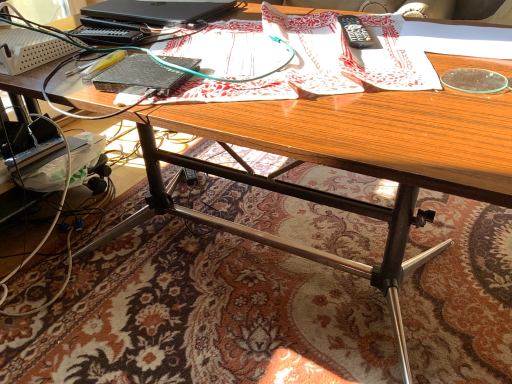
Question: Is the depth of patterned paper at center less than that of black plastic remote control at upper right?

Choices:
 (A) yes
 (B) no

Answer: (A)

Question: Is patterned paper at center touching black plastic remote control at upper right?

Choices:
 (A) yes
 (B) no

Answer: (B)

Question: From the image's perspective, is patterned paper at center on black plastic remote control at upper right?

Choices:
 (A) no
 (B) yes

Answer: (A)

Question: Is patterned paper at center positioned with its back to black plastic remote control at upper right?

Choices:
 (A) yes
 (B) no

Answer: (B)

Question: Considering the relative sizes of patterned paper at center and black plastic remote control at upper right in the image provided, is patterned paper at center shorter than black plastic remote control at upper right?

Choices:
 (A) no
 (B) yes

Answer: (A)

Question: Is patterned paper at center at the right side of black plastic remote control at upper right?

Choices:
 (A) no
 (B) yes

Answer: (A)

Question: Is the position of black matte laptop at upper left less distant than that of black plastic remote control at upper right?

Choices:
 (A) no
 (B) yes

Answer: (A)

Question: Does black matte laptop at upper left contain black plastic remote control at upper right?

Choices:
 (A) no
 (B) yes

Answer: (A)

Question: Is the depth of black matte laptop at upper left greater than that of black plastic remote control at upper right?

Choices:
 (A) yes
 (B) no

Answer: (A)

Question: Does black matte laptop at upper left have a smaller size compared to black plastic remote control at upper right?

Choices:
 (A) no
 (B) yes

Answer: (A)

Question: Is black matte laptop at upper left at the left side of black plastic remote control at upper right?

Choices:
 (A) yes
 (B) no

Answer: (A)

Question: Is black matte laptop at upper left not near black plastic remote control at upper right?

Choices:
 (A) no
 (B) yes

Answer: (A)

Question: Is patterned paper at center far away from black matte laptop at upper left?

Choices:
 (A) no
 (B) yes

Answer: (A)